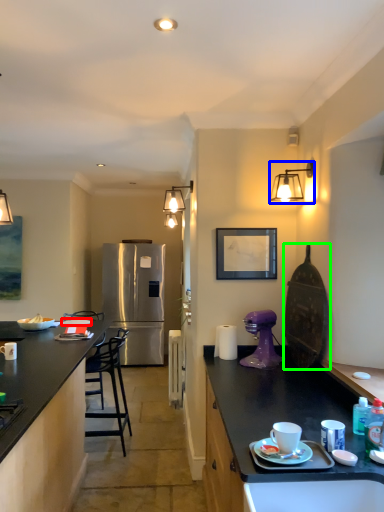
Question: Considering the real-world distances, which object is closest to tableware (highlighted by a red box)? lamp (highlighted by a blue box) or appliance (highlighted by a green box).

Choices:
 (A) lamp
 (B) appliance

Answer: (B)